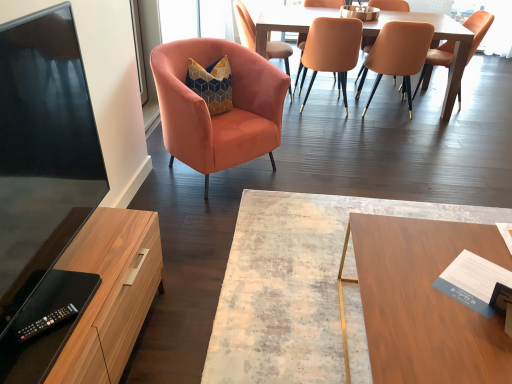
Where is `empty space that is in between light brown wooden table at center and wooden rectangular table at center`? empty space that is in between light brown wooden table at center and wooden rectangular table at center is located at coordinates (371, 153).